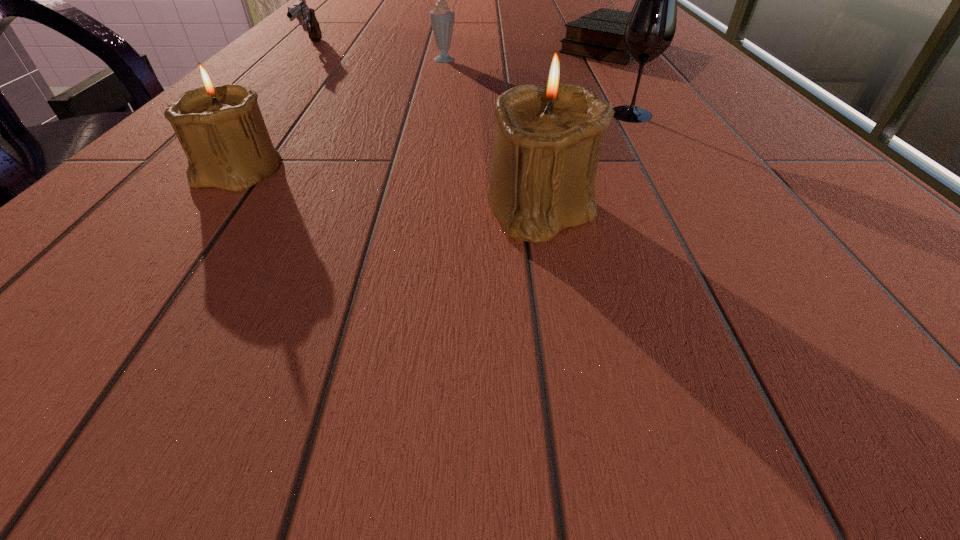
In the current image, all candle_holders are evenly spaced. To maintain this equal spacing, where should an additional candle_holder be placed on the right? Please point out a free spot. Please provide its 2D coordinates. Your answer should be formatted as a tuple, i.e. [(x, y)], where the tuple contains the x and y coordinates of a point satisfying the conditions above.

[(922, 252)]